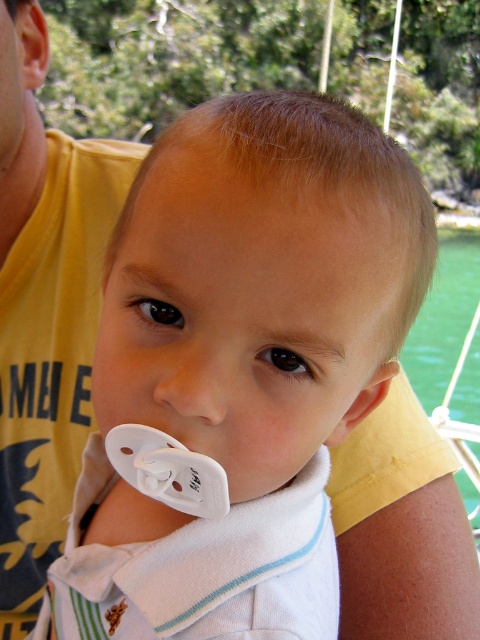
Question: Which point appears closest to the camera in this image?

Choices:
 (A) (311, 384)
 (B) (456, 339)

Answer: (A)

Question: Observing the image, what is the correct spatial positioning of white plastic pacifier at center in reference to green water at lower right?

Choices:
 (A) right
 (B) left

Answer: (B)

Question: Which of the following is the closest to the observer?

Choices:
 (A) green water at lower right
 (B) white plastic pacifier at center

Answer: (B)

Question: Can you confirm if white plastic pacifier at center is thinner than green water at lower right?

Choices:
 (A) yes
 (B) no

Answer: (A)

Question: Is white plastic pacifier at center behind green water at lower right?

Choices:
 (A) no
 (B) yes

Answer: (A)